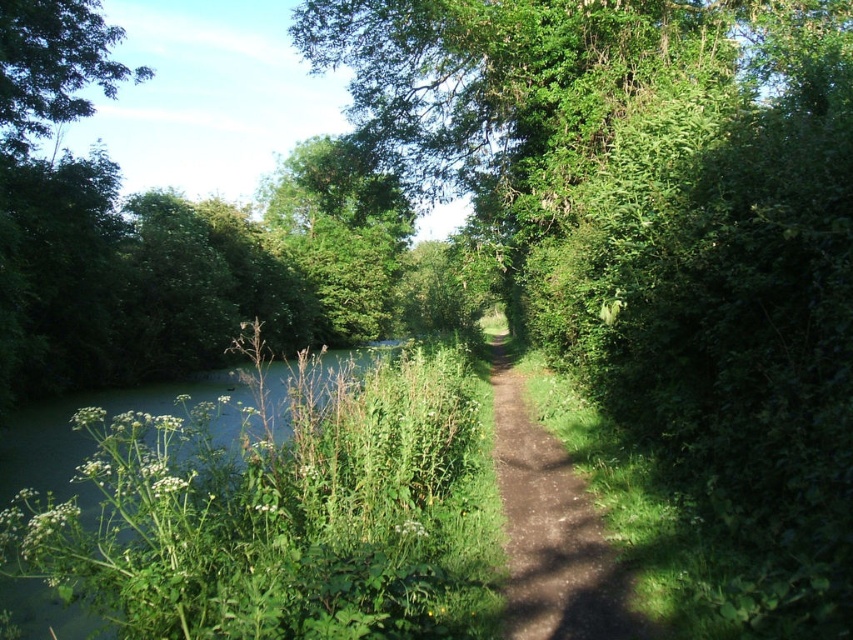
Who is taller, brown dirt path at center or green leafy tree at upper left?

green leafy tree at upper left

Is brown dirt path at center above green leafy tree at upper left?

No, brown dirt path at center is not above green leafy tree at upper left.

Which is behind, point (511, 579) or point (42, 106)?

Positioned behind is point (42, 106).

Find the location of `brown dirt path at center`. brown dirt path at center is located at coordinates (550, 531).

Does green leafy tree at center have a larger size compared to brown dirt path at center?

Indeed, green leafy tree at center has a larger size compared to brown dirt path at center.

Between green leafy tree at center and brown dirt path at center, which one appears on the right side from the viewer's perspective?

green leafy tree at center is more to the right.

Between point (722, 230) and point (590, 520), which one is positioned behind?

Point (590, 520)

Find the location of a particular element. Image resolution: width=853 pixels, height=640 pixels. green leafy tree at center is located at coordinates (654, 230).

Is point (723, 401) closer to camera compared to point (115, 76)?

Yes.

Between point (438, 163) and point (36, 68), which one is positioned behind?

The point (438, 163) is behind.

What do you see at coordinates (654, 230) in the screenshot?
I see `green leafy tree at center` at bounding box center [654, 230].

At what (x,y) coordinates should I click in order to perform the action: click on green leafy tree at center. Please return your answer as a coordinate pair (x, y). Looking at the image, I should click on (654, 230).